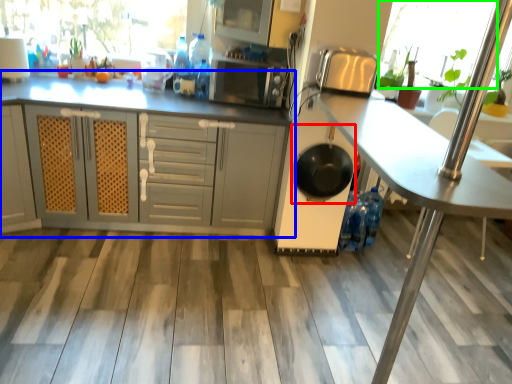
Question: Estimate the real-world distances between objects in this image. Which object is closer to frying pan (highlighted by a red box), cabinetry (highlighted by a blue box) or window screen (highlighted by a green box)?

Choices:
 (A) cabinetry
 (B) window screen

Answer: (A)